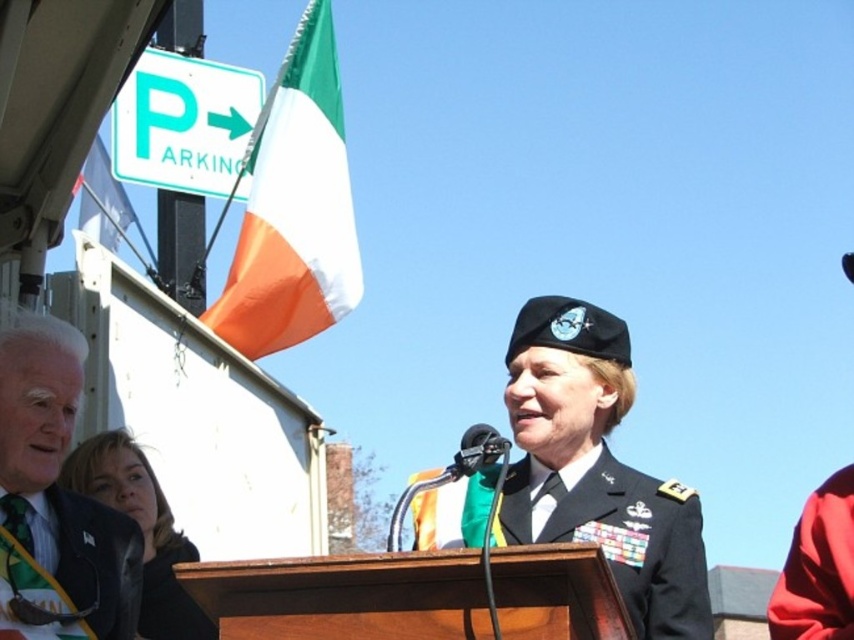
Which is in front, point (85, 516) or point (79, 228)?

Positioned in front is point (85, 516).

Is point (108, 616) more distant than point (102, 168)?

That is False.

Which is behind, point (38, 582) or point (97, 234)?

The point (97, 234) is behind.

This screenshot has height=640, width=854. I want to click on dark gray suit at left, so click(x=54, y=500).

Who is shorter, black military uniform at center or dark green fabric uniform at lower left?

With less height is dark green fabric uniform at lower left.

Is point (605, 461) positioned after point (56, 600)?

Yes, it is behind point (56, 600).

You are a GUI agent. You are given a task and a screenshot of the screen. Output one action in this format:
    pyautogui.click(x=<x>, y=<y>)
    Task: Click on the black military uniform at center
    This screenshot has width=854, height=640.
    Given the screenshot: What is the action you would take?
    pyautogui.click(x=641, y=545)

Is dark green fabric uniform at lower left to the right of smooth black hair at lower left from the viewer's perspective?

Incorrect, dark green fabric uniform at lower left is not on the right side of smooth black hair at lower left.

Between point (127, 595) and point (151, 637), which one is positioned in front?

Point (127, 595) is more forward.

What do you see at coordinates (73, 573) in the screenshot? I see `dark green fabric uniform at lower left` at bounding box center [73, 573].

Locate an element on the screen. This screenshot has width=854, height=640. dark green fabric uniform at lower left is located at coordinates (73, 573).